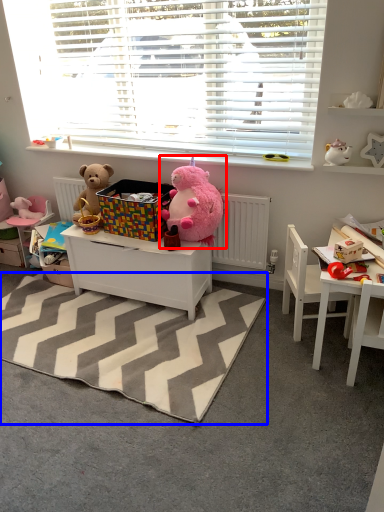
Question: Which object is closer to the camera taking this photo, teddy bear (highlighted by a red box) or mat (highlighted by a blue box)?

Choices:
 (A) teddy bear
 (B) mat

Answer: (B)